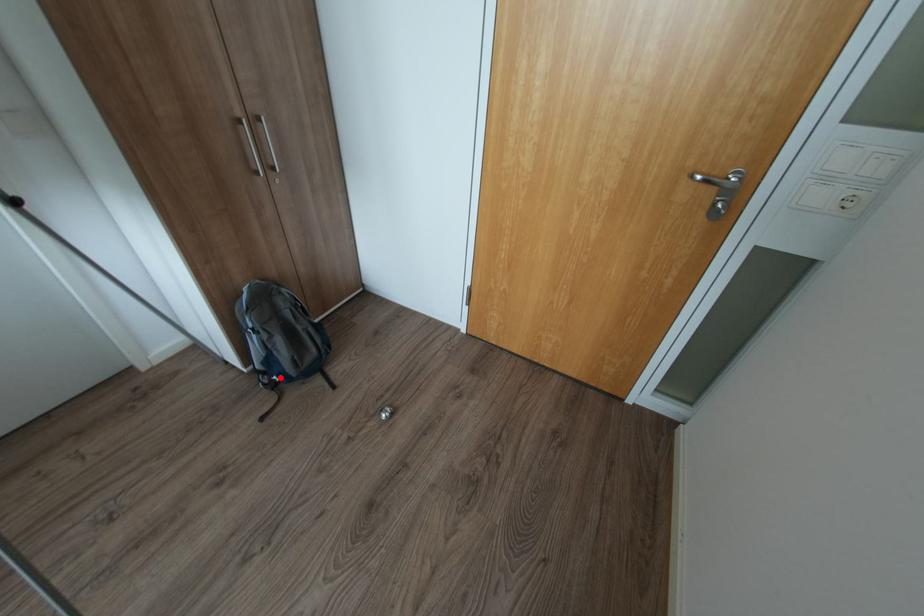
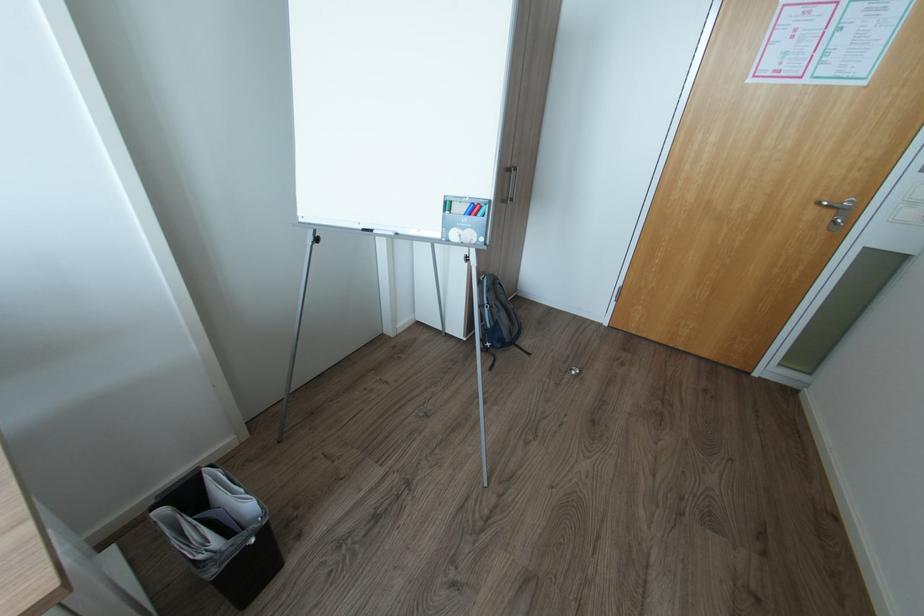
In the second image, find the point that corresponds to the highlighted location in the first image.

(492, 344)